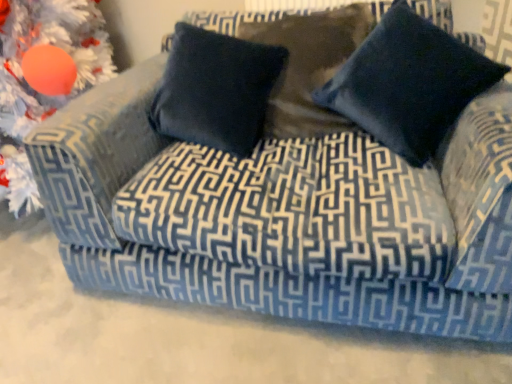
Question: Is orange matte ornament at upper left positioned before navy velvet pillow at upper right, the 2th pillow in the left-to-right sequence?

Choices:
 (A) no
 (B) yes

Answer: (A)

Question: Is orange matte ornament at upper left placed right next to navy velvet pillow at upper right, the 2th pillow in the left-to-right sequence?

Choices:
 (A) no
 (B) yes

Answer: (A)

Question: Could you tell me if orange matte ornament at upper left is facing navy velvet pillow at upper right, which ranks as the 1th pillow in right-to-left order?

Choices:
 (A) yes
 (B) no

Answer: (B)

Question: Is orange matte ornament at upper left turned away from navy velvet pillow at upper right, which ranks as the 1th pillow in right-to-left order?

Choices:
 (A) yes
 (B) no

Answer: (B)

Question: From a real-world perspective, does orange matte ornament at upper left stand above navy velvet pillow at upper right, the 2th pillow in the left-to-right sequence?

Choices:
 (A) yes
 (B) no

Answer: (B)

Question: Do you think navy blue velvet pillow at center, the first pillow positioned from the left, is within navy velvet pillow at upper right, the 2th pillow in the left-to-right sequence, or outside of it?

Choices:
 (A) inside
 (B) outside

Answer: (B)

Question: Looking at the image, does navy blue velvet pillow at center, positioned as the second pillow in right-to-left order, seem bigger or smaller compared to navy velvet pillow at upper right, the 2th pillow in the left-to-right sequence?

Choices:
 (A) small
 (B) big

Answer: (A)

Question: From the image's perspective, relative to navy velvet pillow at upper right, which ranks as the 1th pillow in right-to-left order, is navy blue velvet pillow at center, positioned as the second pillow in right-to-left order, above or below?

Choices:
 (A) below
 (B) above

Answer: (B)

Question: Is navy blue velvet pillow at center, the first pillow positioned from the left, taller or shorter than navy velvet pillow at upper right, the 2th pillow in the left-to-right sequence?

Choices:
 (A) tall
 (B) short

Answer: (B)

Question: Would you say navy blue velvet pillow at center, positioned as the second pillow in right-to-left order, is inside or outside orange matte ornament at upper left?

Choices:
 (A) inside
 (B) outside

Answer: (B)

Question: From the image's perspective, is navy blue velvet pillow at center, the first pillow positioned from the left, positioned above or below orange matte ornament at upper left?

Choices:
 (A) above
 (B) below

Answer: (A)

Question: Looking at the image, does navy blue velvet pillow at center, the first pillow positioned from the left, seem bigger or smaller compared to orange matte ornament at upper left?

Choices:
 (A) big
 (B) small

Answer: (B)

Question: From a real-world perspective, is navy blue velvet pillow at center, the first pillow positioned from the left, physically located above or below orange matte ornament at upper left?

Choices:
 (A) below
 (B) above

Answer: (B)

Question: Considering the relative positions of orange matte ornament at upper left and navy blue velvet pillow at center, positioned as the second pillow in right-to-left order, in the image provided, is orange matte ornament at upper left to the left or to the right of navy blue velvet pillow at center, positioned as the second pillow in right-to-left order,?

Choices:
 (A) left
 (B) right

Answer: (A)

Question: Is orange matte ornament at upper left wider or thinner than navy blue velvet pillow at center, the first pillow positioned from the left?

Choices:
 (A) thin
 (B) wide

Answer: (B)